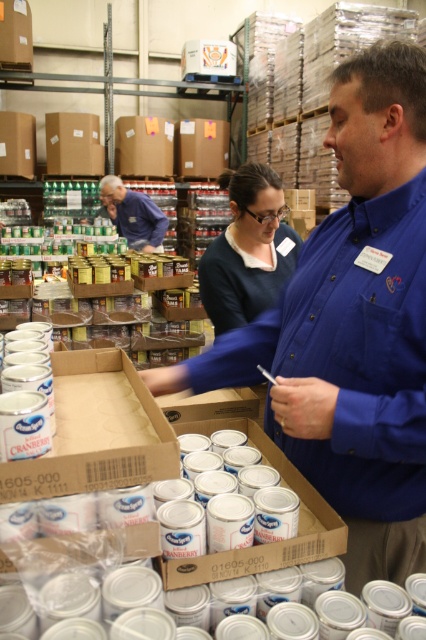
Question: Is blue button-up shirt at center wider than matte blue shirt at center?

Choices:
 (A) no
 (B) yes

Answer: (A)

Question: Does blue button-up shirt at center appear on the left side of matte blue shirt at center?

Choices:
 (A) yes
 (B) no

Answer: (B)

Question: Which point is farther from the camera taking this photo?

Choices:
 (A) (146, 234)
 (B) (264, 355)

Answer: (A)

Question: Does dark blue sweater at center appear on the right side of matte blue shirt at center?

Choices:
 (A) no
 (B) yes

Answer: (B)

Question: Which point is closer to the camera?

Choices:
 (A) (138, 212)
 (B) (256, 326)
 (C) (227, 244)

Answer: (B)

Question: Which object is positioned farthest from the matte blue shirt at center?

Choices:
 (A) dark blue sweater at center
 (B) blue button-up shirt at center

Answer: (B)